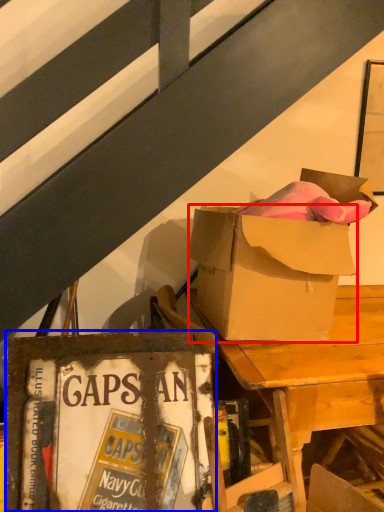
Question: Which object appears closest to the camera in this image, box (highlighted by a red box) or paperback book (highlighted by a blue box)?

Choices:
 (A) box
 (B) paperback book

Answer: (B)